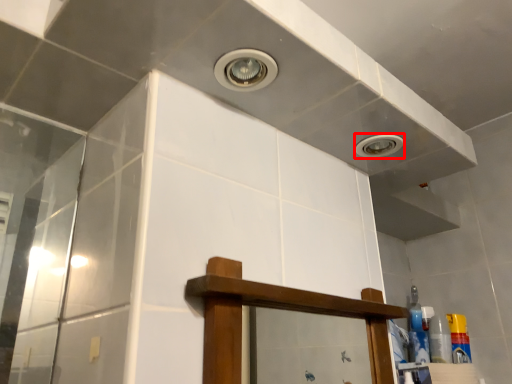
Question: From the image's perspective, where is droplight (annotated by the red box) located in relation to toiletry in the image?

Choices:
 (A) above
 (B) below

Answer: (A)